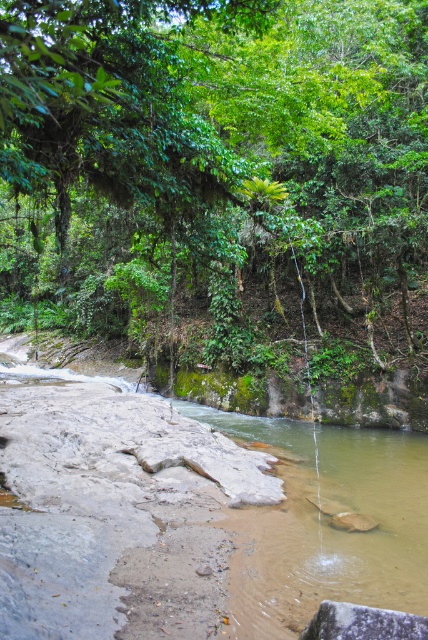
You are planning to take a photo of the green leafy forest at upper center and the brown rocky river at center. Which object will occupy more space in the photo frame?

The green leafy forest at upper center will occupy more space in the photo frame because its width is larger than that of the brown rocky river at center.

You are a hiker standing at the base of the green leafy forest at upper center. You want to cross the brown rocky river at center to reach the other side. Which direction should you move relative to the forest to get to the river?

Since the green leafy forest at upper center is in front of the brown rocky river at center, you should move away from the forest towards the direction opposite of where it is located to reach the river.

You are a hiker standing at the brown rocky river at center and want to reach the green leafy forest at upper center. Which direction should you move to get there?

You should move upward to reach the green leafy forest at upper center because it is much taller than the brown rocky river at center.